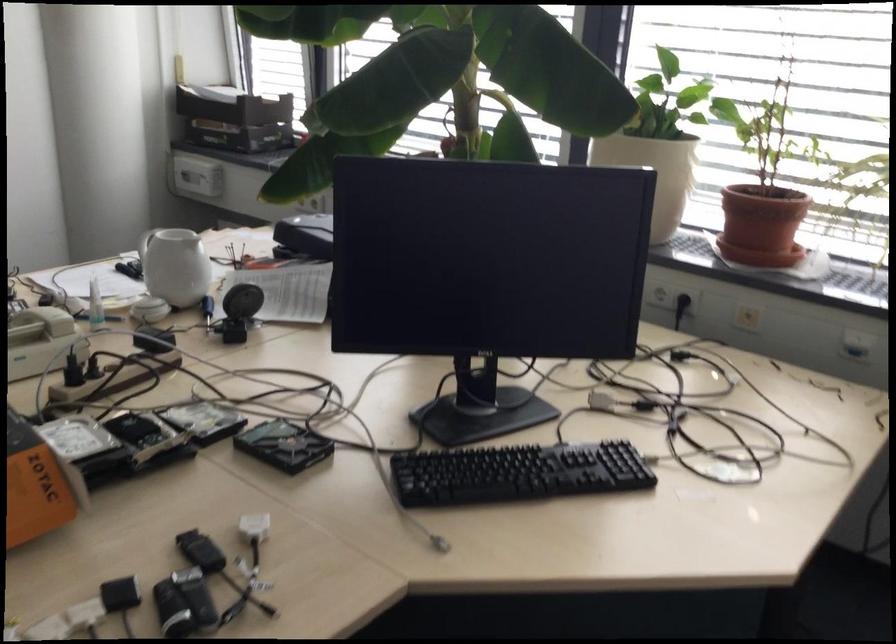
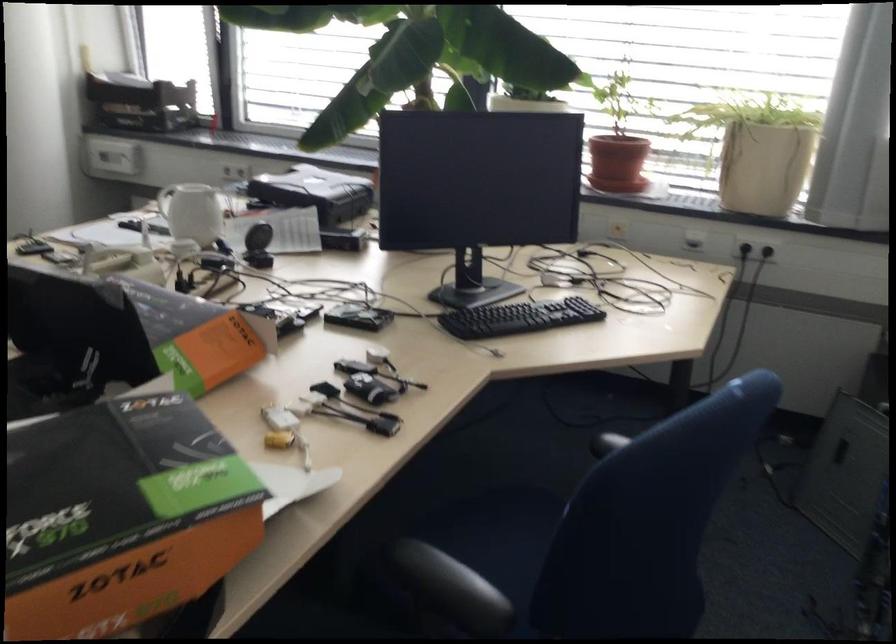
Which direction would the cameraman need to move to produce the second image?

The movement direction of the cameraman is left, backward.